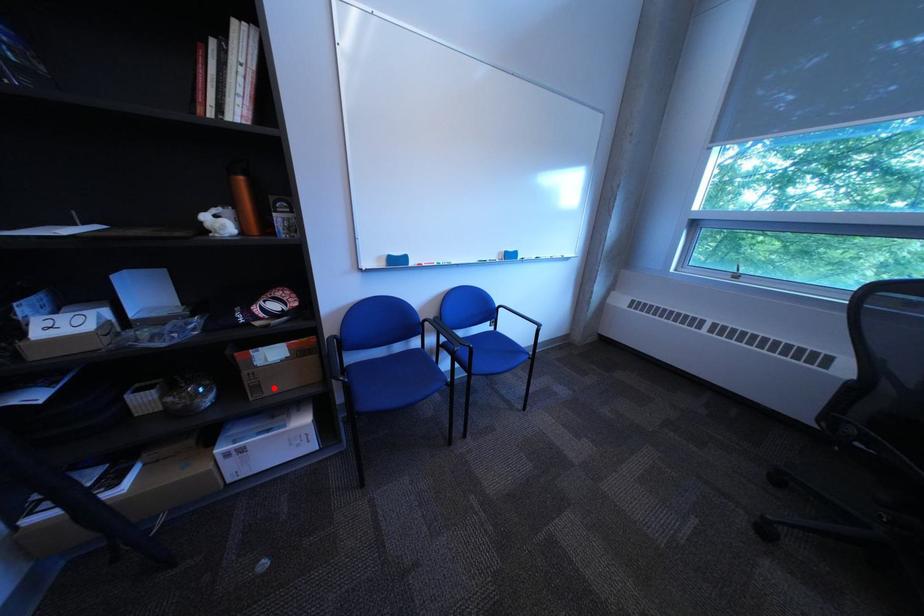
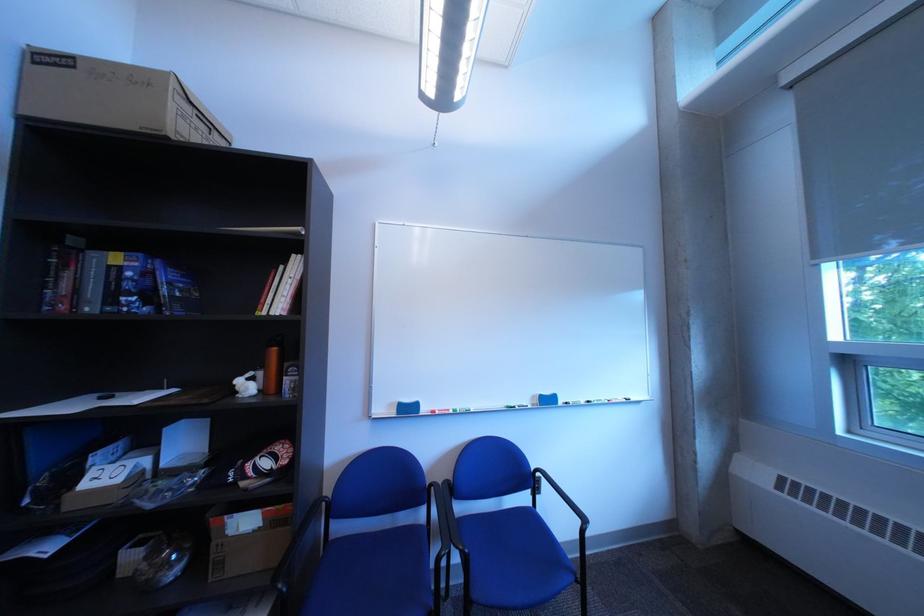
Question: I am providing you with two images of the same scene from different viewpoints. A red point is marked on the first image. Is the red point's position out of view in image 2?

Choices:
 (A) Yes
 (B) No

Answer: (B)